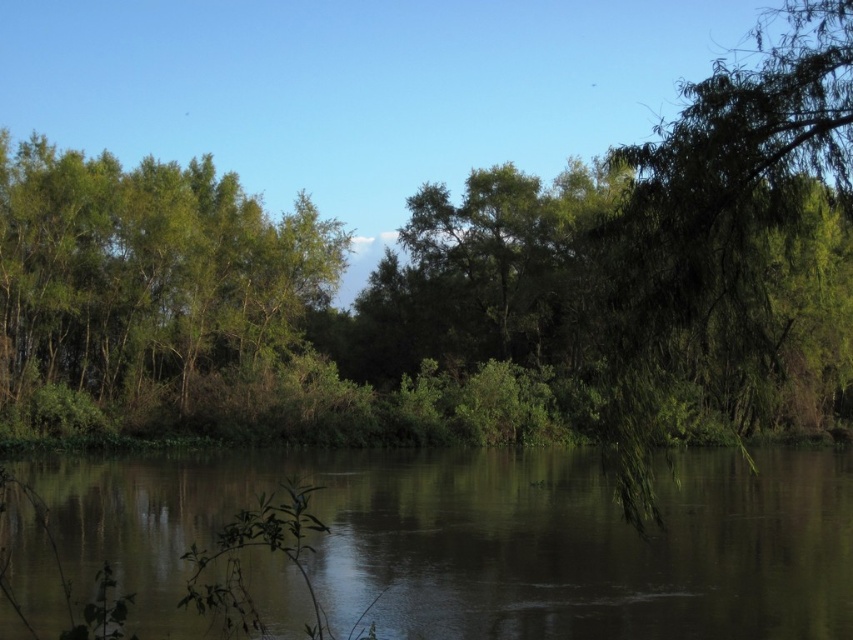
Which is behind, point (585, 538) or point (80, 156)?

The point (80, 156) is behind.

Can you confirm if brown reflective water at center is smaller than green leafy tree at left?

Yes.

Which is in front, point (154, 616) or point (39, 289)?

Point (154, 616) is in front.

Identify the location of brown reflective water at center. The width and height of the screenshot is (853, 640). (488, 540).

At what (x,y) coordinates should I click in order to perform the action: click on green leafy tree at center. Please return your answer as a coordinate pair (x, y). The width and height of the screenshot is (853, 640). Looking at the image, I should click on (288, 307).

Does green leafy tree at center appear on the left side of brown reflective water at center?

Correct, you'll find green leafy tree at center to the left of brown reflective water at center.

Is point (440, 307) positioned before point (691, 547)?

No, it is not.

I want to click on green leafy tree at center, so click(x=288, y=307).

Can you confirm if green leafy tree at center is positioned to the left of green leafy tree at left?

Incorrect, green leafy tree at center is not on the left side of green leafy tree at left.

Which of these two, green leafy tree at center or green leafy tree at left, stands taller?

green leafy tree at center is taller.

Identify the location of green leafy tree at center. (288, 307).